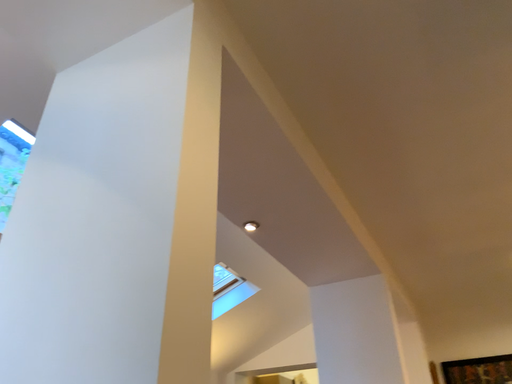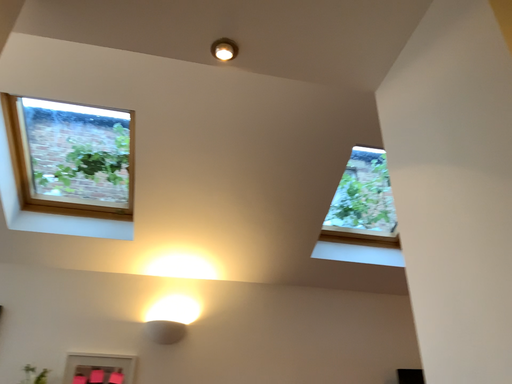
Question: How did the camera likely rotate when shooting the video?

Choices:
 (A) rotated right
 (B) rotated left

Answer: (B)